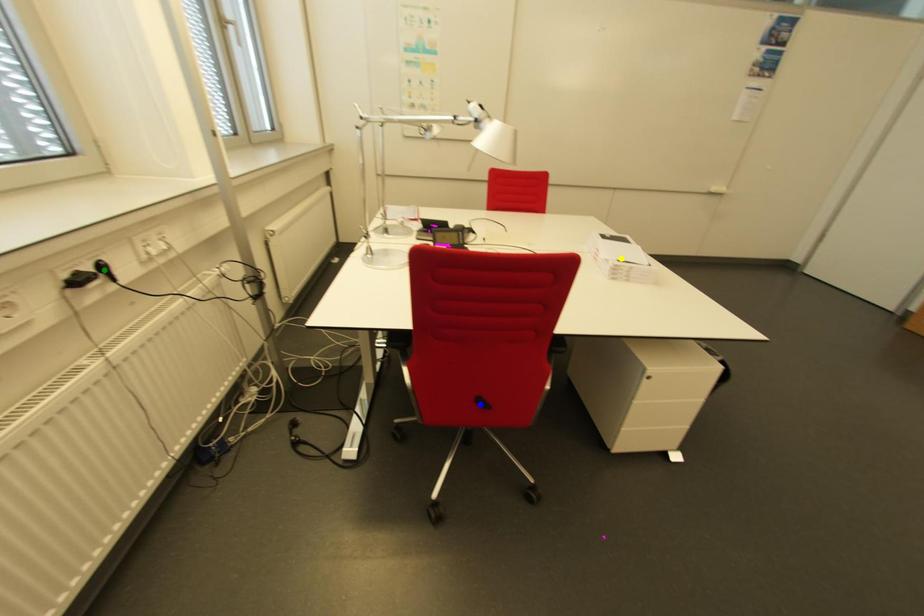
Order these from nearest to farthest:
blue point
green point
yellow point

green point < blue point < yellow point